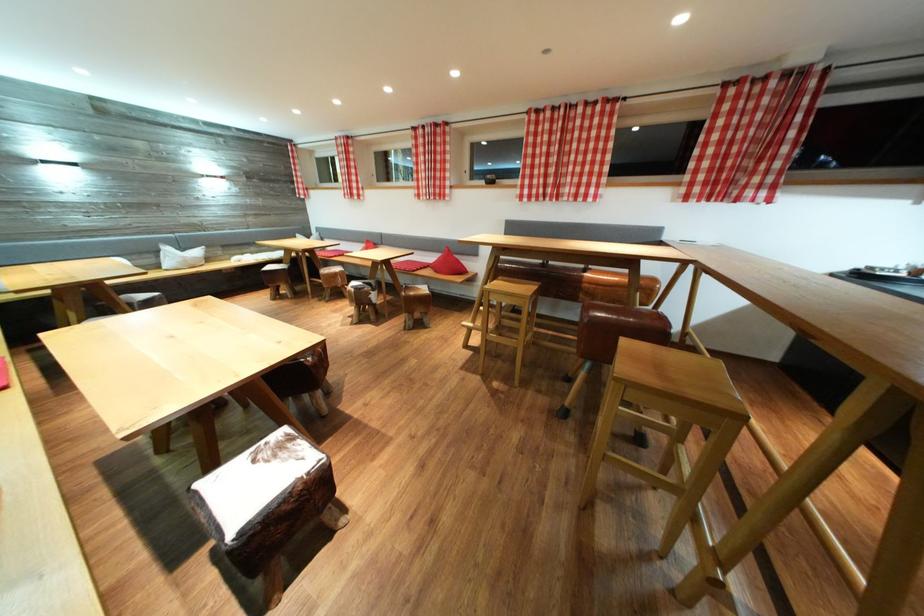
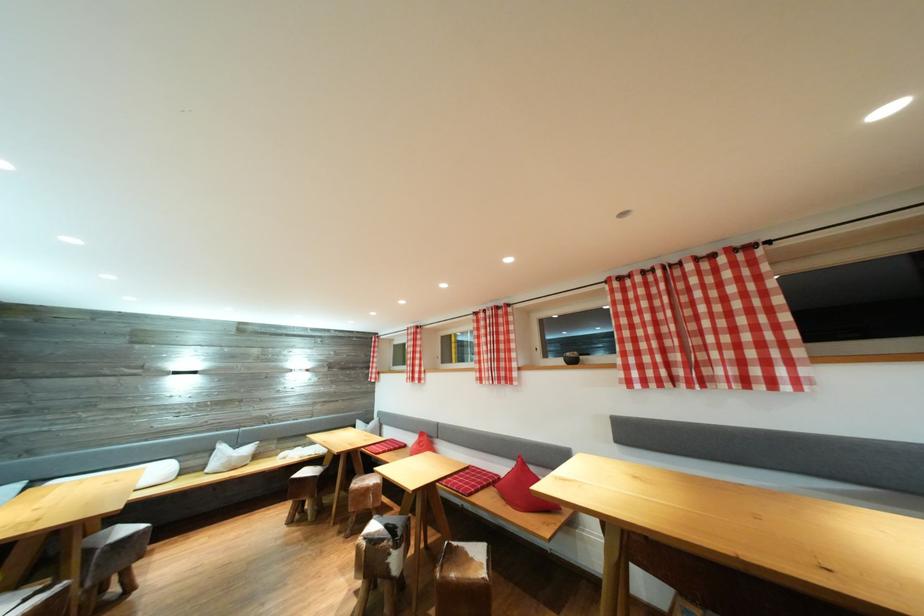
In the second image, find the point that corresponds to (x=148, y=302) in the first image.

(131, 536)